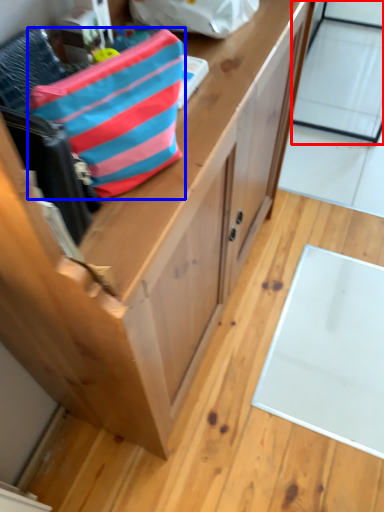
Question: Among these objects, which one is farthest to the camera, glass door (highlighted by a red box) or pouch (highlighted by a blue box)?

Choices:
 (A) glass door
 (B) pouch

Answer: (A)